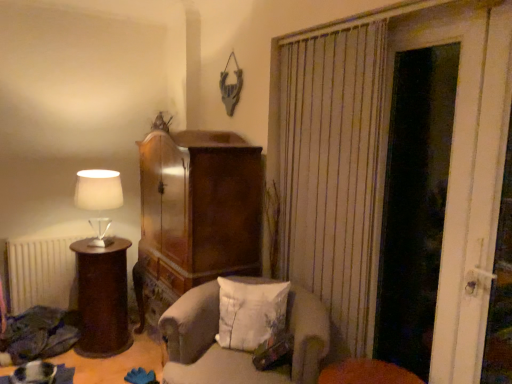
Find the location of `empty space that is ontop of white matte radiator at lower left (from a real-world perspective)`. empty space that is ontop of white matte radiator at lower left (from a real-world perspective) is located at coordinates (71, 226).